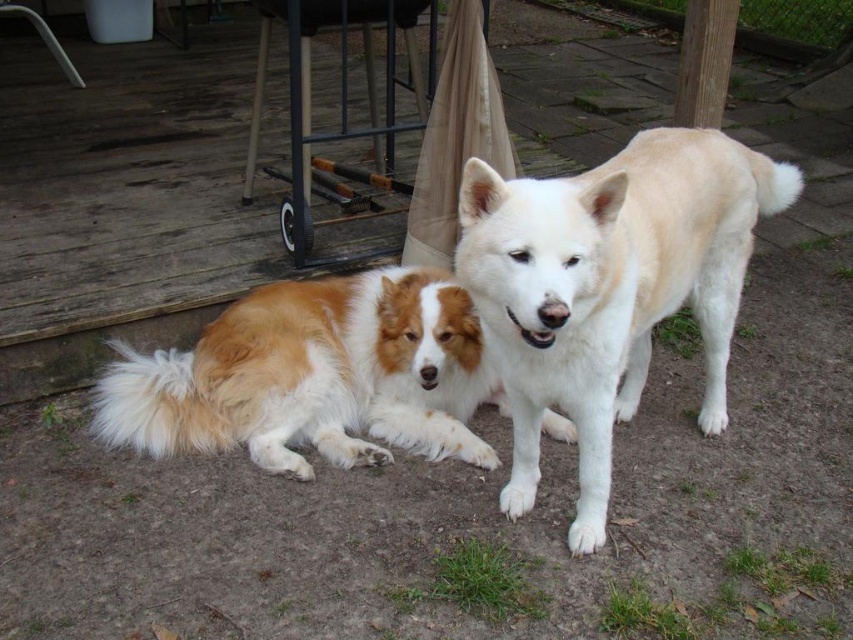
Is white fur dog at center positioned in front of brown and white fur dog at center?

Yes, white fur dog at center is in front of brown and white fur dog at center.

Who is more distant from viewer, (508,490) or (374,355)?

The point (374,355) is behind.

The image size is (853, 640). Identify the location of white fur dog at center. (608, 288).